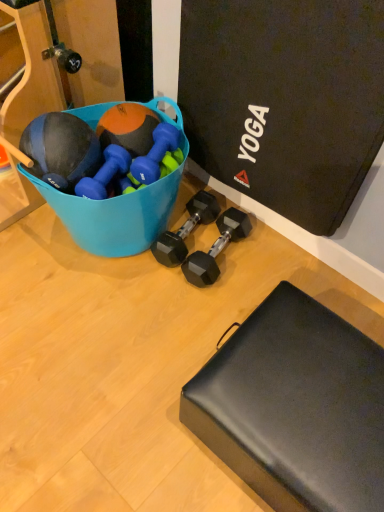
Question: Is there a large distance between blue plastic bucket at upper left and blue rubber dumbbell at center, which ranks as the second dumbbell in left-to-right order?

Choices:
 (A) no
 (B) yes

Answer: (A)

Question: From a real-world perspective, does blue plastic bucket at upper left stand above blue rubber dumbbell at center, which appears as the 3th dumbbell when viewed from the right?

Choices:
 (A) yes
 (B) no

Answer: (B)

Question: Considering the relative sizes of blue plastic bucket at upper left and blue rubber dumbbell at center, which ranks as the second dumbbell in left-to-right order, in the image provided, is blue plastic bucket at upper left wider than blue rubber dumbbell at center, which ranks as the second dumbbell in left-to-right order,?

Choices:
 (A) no
 (B) yes

Answer: (B)

Question: From the image's perspective, does blue plastic bucket at upper left appear higher than blue rubber dumbbell at center, which ranks as the second dumbbell in left-to-right order?

Choices:
 (A) yes
 (B) no

Answer: (B)

Question: From the image's perspective, is blue plastic bucket at upper left beneath blue rubber dumbbell at center, which ranks as the second dumbbell in left-to-right order?

Choices:
 (A) yes
 (B) no

Answer: (A)

Question: Is blue rubber dumbbell at center, which appears as the 3th dumbbell when viewed from the right, at the back of blue plastic bucket at upper left?

Choices:
 (A) yes
 (B) no

Answer: (B)

Question: Is black matte footrest at lower right bigger than black rubber dumbbell at center, which is the 4th dumbbell in left-to-right order?

Choices:
 (A) yes
 (B) no

Answer: (A)

Question: Does black matte footrest at lower right have a greater height compared to black rubber dumbbell at center, marked as the first dumbbell in a right-to-left arrangement?

Choices:
 (A) yes
 (B) no

Answer: (A)

Question: Is black rubber dumbbell at center, which is the 4th dumbbell in left-to-right order, at the back of black matte footrest at lower right?

Choices:
 (A) yes
 (B) no

Answer: (B)

Question: Is black matte footrest at lower right not within black rubber dumbbell at center, marked as the first dumbbell in a right-to-left arrangement?

Choices:
 (A) yes
 (B) no

Answer: (A)

Question: From the image's perspective, would you say black matte footrest at lower right is positioned over black rubber dumbbell at center, which is the 4th dumbbell in left-to-right order?

Choices:
 (A) yes
 (B) no

Answer: (B)

Question: From a real-world perspective, is black matte footrest at lower right under black rubber dumbbell at center, which is the 4th dumbbell in left-to-right order?

Choices:
 (A) yes
 (B) no

Answer: (B)

Question: From the image's perspective, is black matte footrest at lower right below blue plastic bucket at upper left?

Choices:
 (A) yes
 (B) no

Answer: (A)